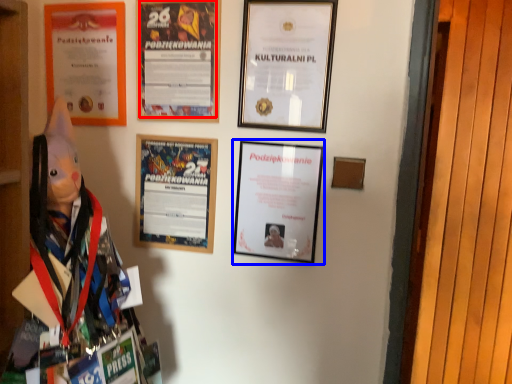
Question: Among these objects, which one is farthest to the camera, poster (highlighted by a red box) or picture frame (highlighted by a blue box)?

Choices:
 (A) poster
 (B) picture frame

Answer: (A)